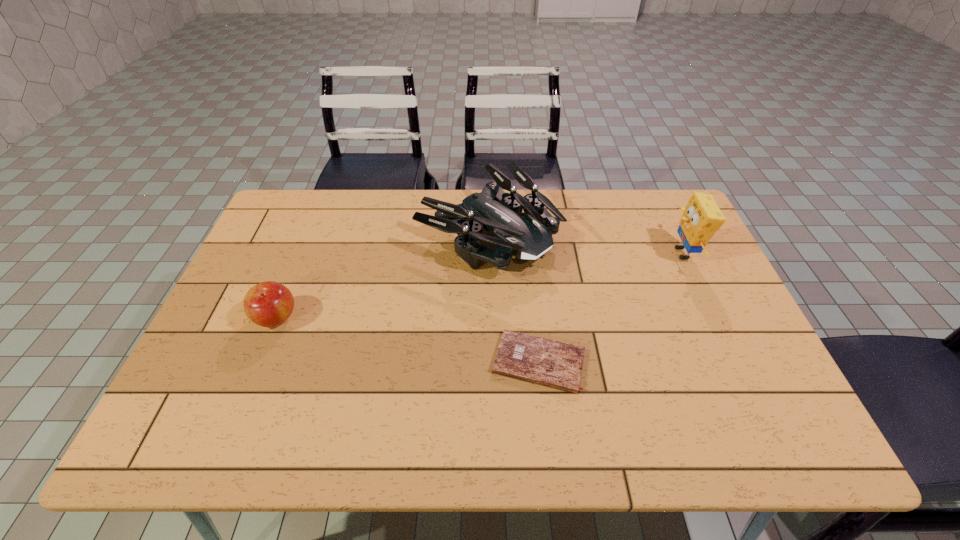
Where is `the rightmost object`? This screenshot has height=540, width=960. the rightmost object is located at coordinates [x=701, y=218].

The width and height of the screenshot is (960, 540). What are the coordinates of `sponge` in the screenshot? It's located at (701, 218).

Locate an element on the screen. The image size is (960, 540). the second tallest object is located at coordinates (528, 236).

Identify the location of apple. (267, 304).

Image resolution: width=960 pixels, height=540 pixels. Find the location of `the third tallest object`. the third tallest object is located at coordinates (267, 304).

At what (x,y) coordinates should I click in order to perform the action: click on Bible. Please return your answer as a coordinate pair (x, y). The width and height of the screenshot is (960, 540). Looking at the image, I should click on (529, 358).

Where is `vacant region located 0.230m on the face of the tallest object`? vacant region located 0.230m on the face of the tallest object is located at coordinates (591, 253).

Find the location of a particular element. vacant space situated on the face of the tallest object is located at coordinates (598, 253).

You are a GUI agent. You are given a task and a screenshot of the screen. Output one action in this format:
    pyautogui.click(x=<x>, y=<y>)
    Task: Click on the vacant region located 0.110m on the face of the tallest object
    This screenshot has width=960, height=540.
    Given the screenshot: What is the action you would take?
    click(x=631, y=253)

Image resolution: width=960 pixels, height=540 pixels. Identify the location of free space located on the left of the drone. pyautogui.click(x=396, y=235).